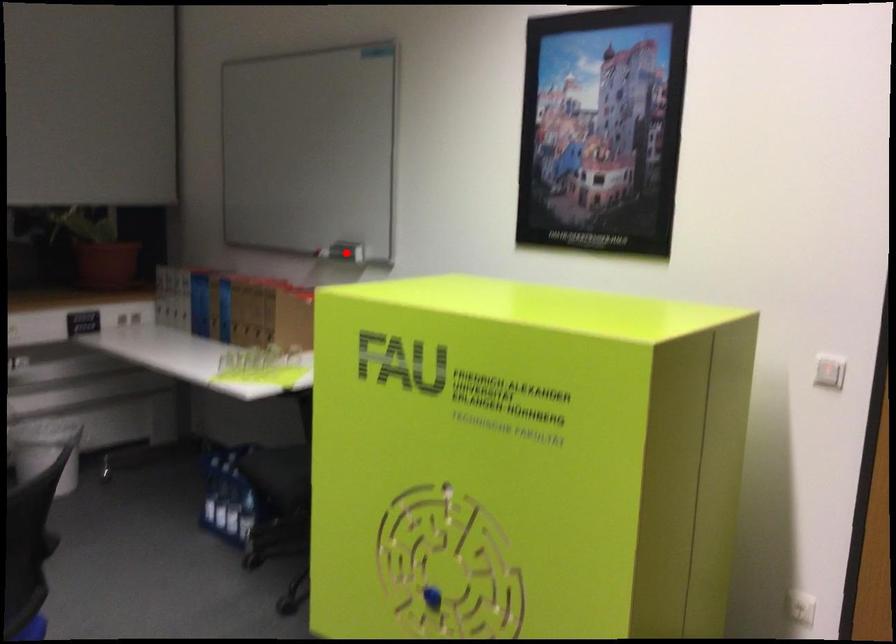
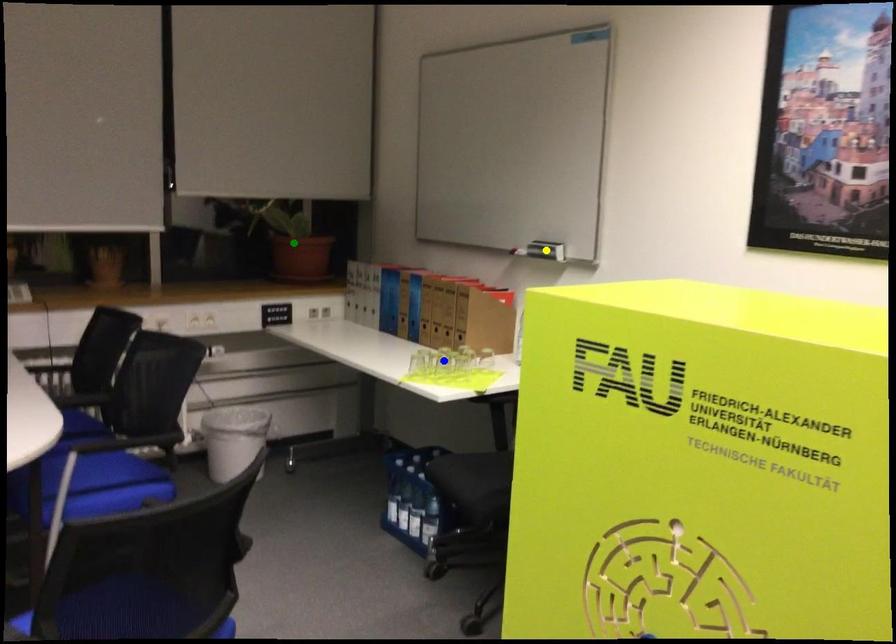
Question: I am providing you with two images of the same scene from different viewpoints. A red point is marked on the first image. You are given multiple points on the second image. Can you choose the point in image 2 that corresponds to the point in image 1?

Choices:
 (A) blue point
 (B) green point
 (C) yellow point

Answer: (C)